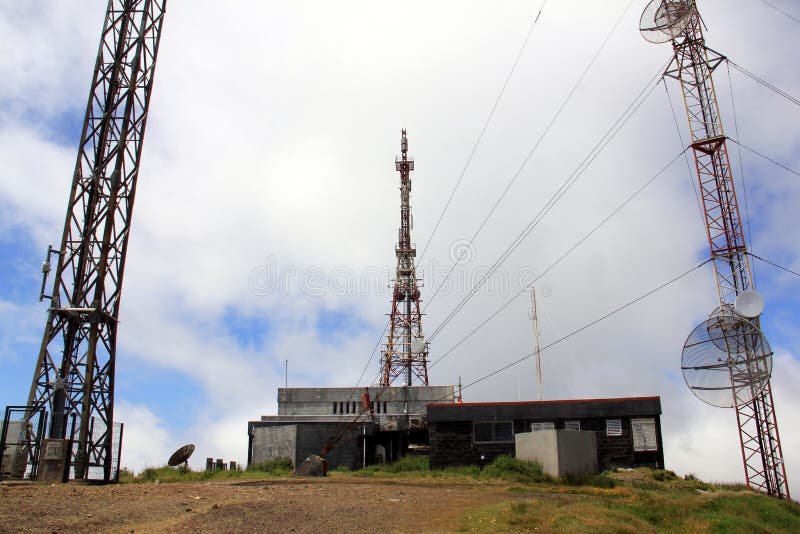
Where is `cables`? cables is located at coordinates (517, 340), (549, 258), (541, 226), (505, 187), (448, 146), (766, 264), (774, 162), (762, 83).